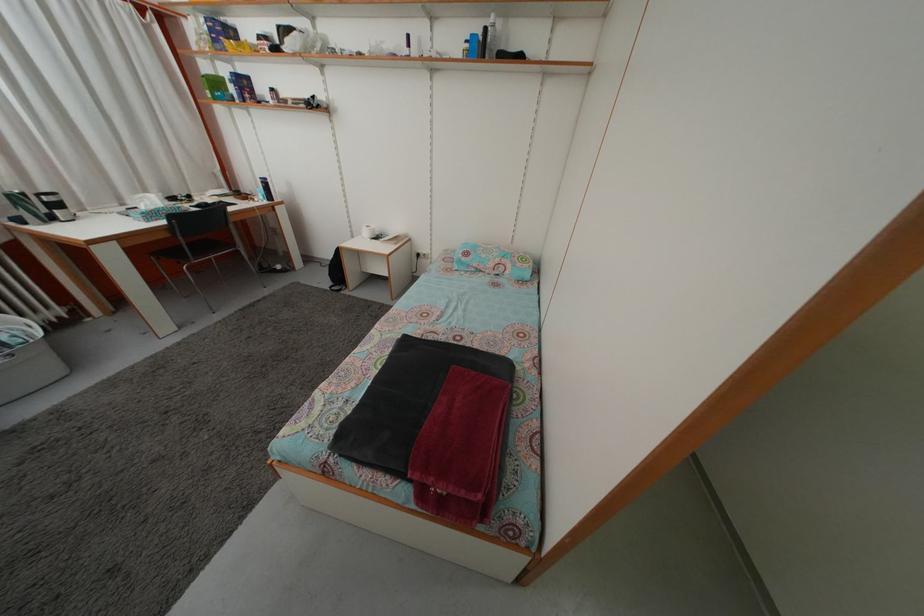
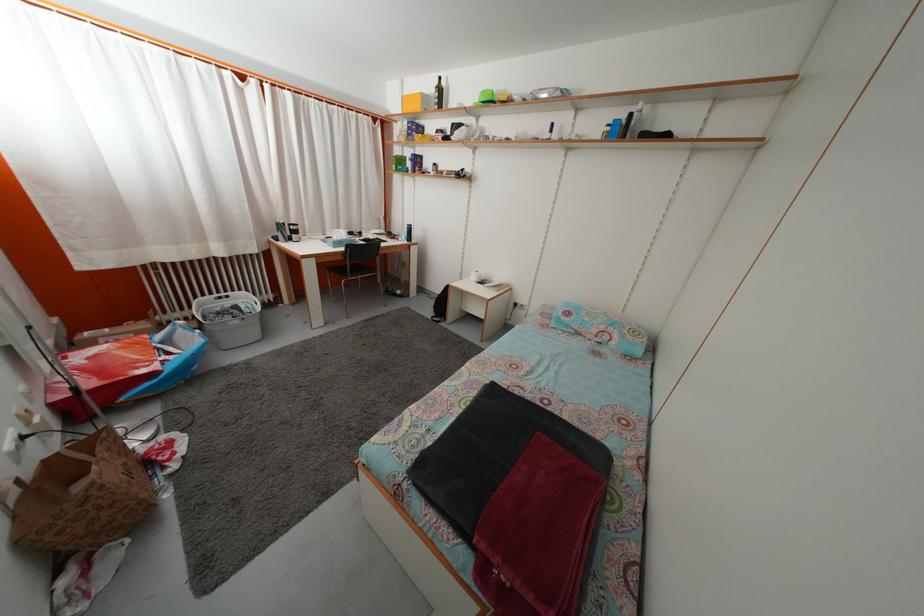
Question: The images are taken continuously from a first-person perspective. In which direction is your viewpoint rotating?

Choices:
 (A) Left
 (B) Right
 (C) Up
 (D) Down

Answer: (A)